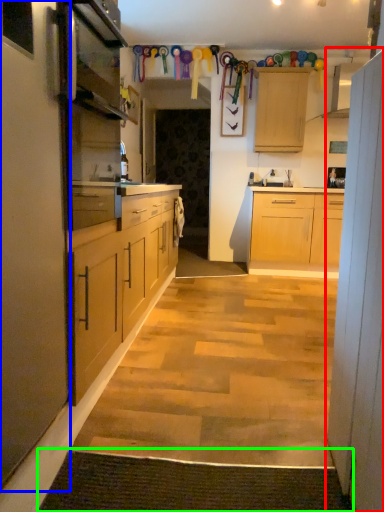
Question: Which object is positioned closest to cabinet (highlighted by a red box)? Select from cabinet (highlighted by a blue box) and doormat (highlighted by a green box).

Choices:
 (A) cabinet
 (B) doormat

Answer: (B)